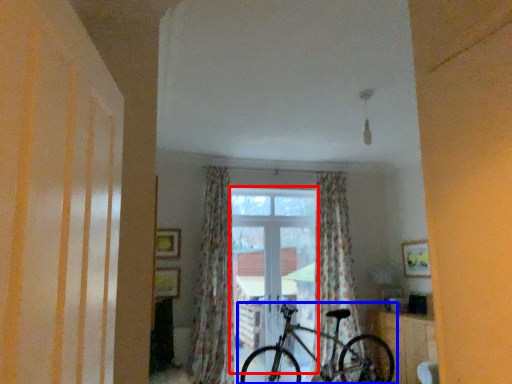
Question: Which point is closer to the camera, window (highlighted by a red box) or bicycle (highlighted by a blue box)?

Choices:
 (A) window
 (B) bicycle

Answer: (B)